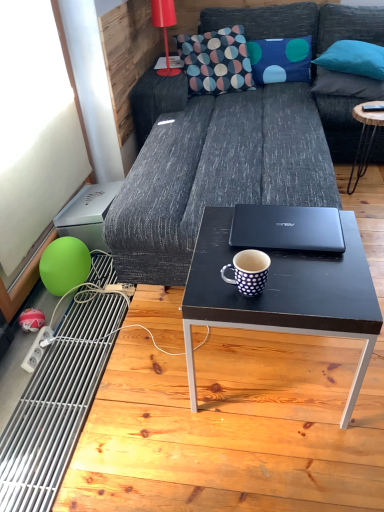
Where is `vacant area that lies between white dotted ceramic mug at center and black matte laptop at center`? The height and width of the screenshot is (512, 384). vacant area that lies between white dotted ceramic mug at center and black matte laptop at center is located at coordinates (285, 268).